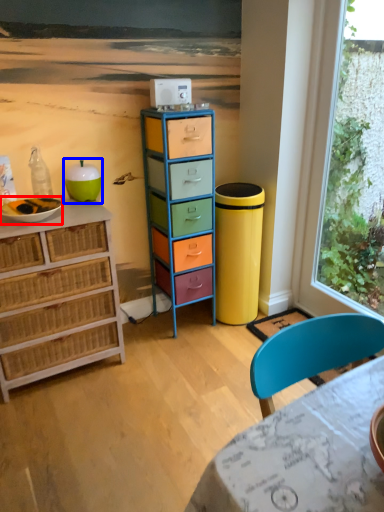
Question: Among these objects, which one is farthest to the camera, bowl (highlighted by a red box) or teal (highlighted by a blue box)?

Choices:
 (A) bowl
 (B) teal

Answer: (B)